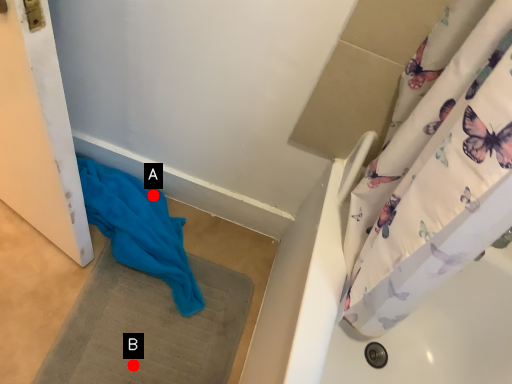
Question: Two points are circled on the image, labeled by A and B beside each circle. Which point is farther from the camera taking this photo?

Choices:
 (A) A is further
 (B) B is further

Answer: (A)